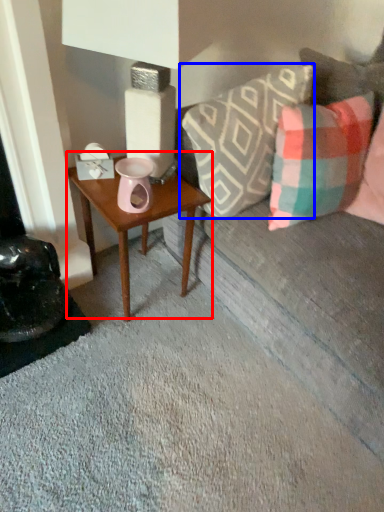
Question: Which object appears closest to the camera in this image, table (highlighted by a red box) or pillow (highlighted by a blue box)?

Choices:
 (A) table
 (B) pillow

Answer: (B)